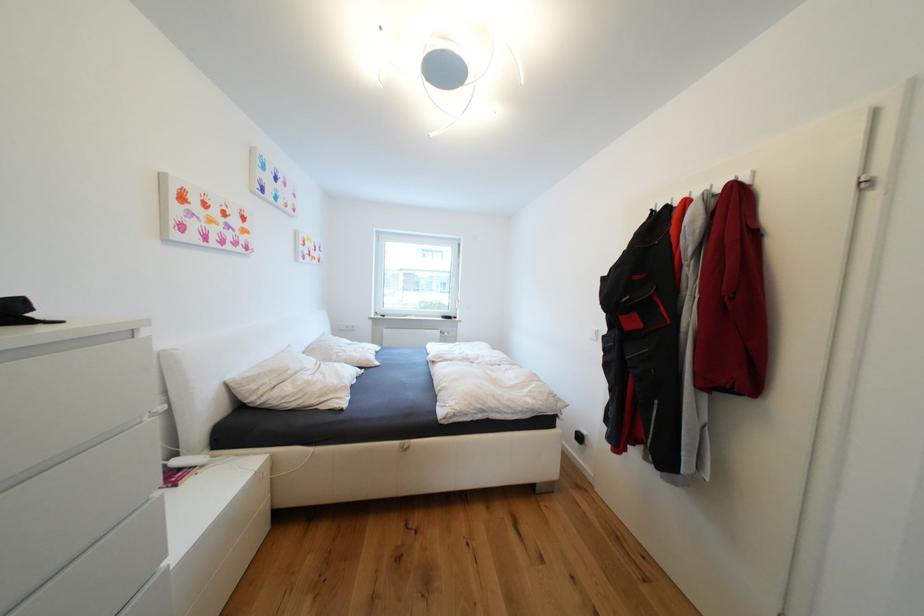
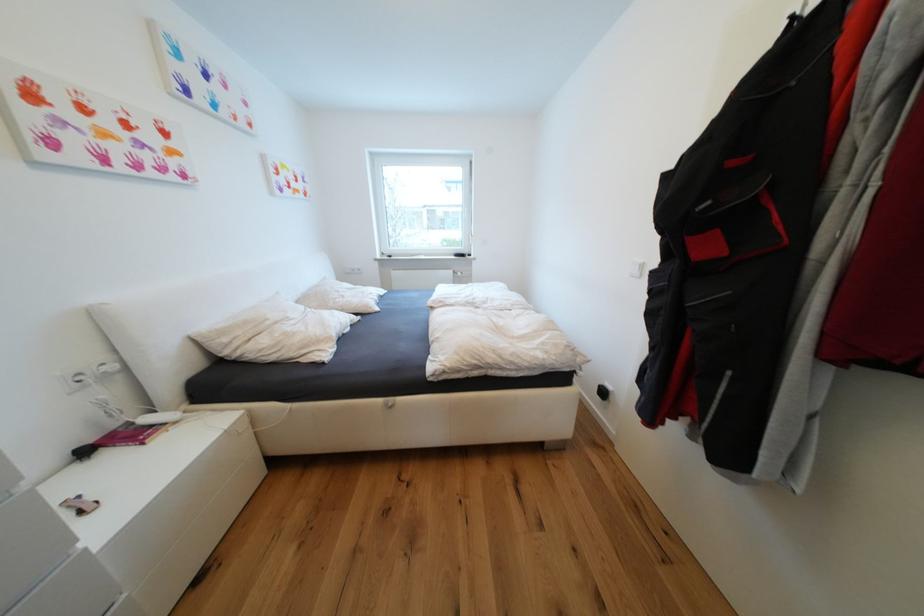
Where in the second image is the point corresponding to pixel 638 323 from the first image?

(714, 249)